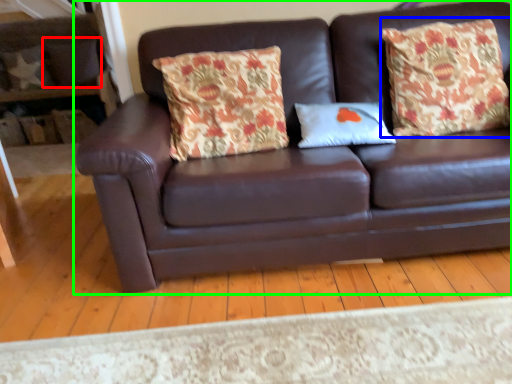
Question: Which object is positioned closest to pillow (highlighted by a red box)? Select from throw pillow (highlighted by a blue box) and studio couch (highlighted by a green box).

Choices:
 (A) throw pillow
 (B) studio couch

Answer: (B)